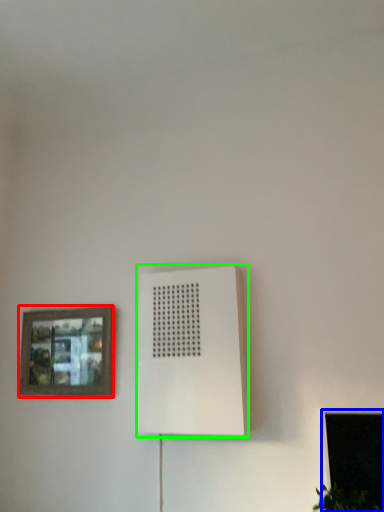
Question: Based on their relative distances, which object is farther from picture frame (highlighted by a red box)? Choose from window (highlighted by a blue box) and air conditioning (highlighted by a green box).

Choices:
 (A) window
 (B) air conditioning

Answer: (A)